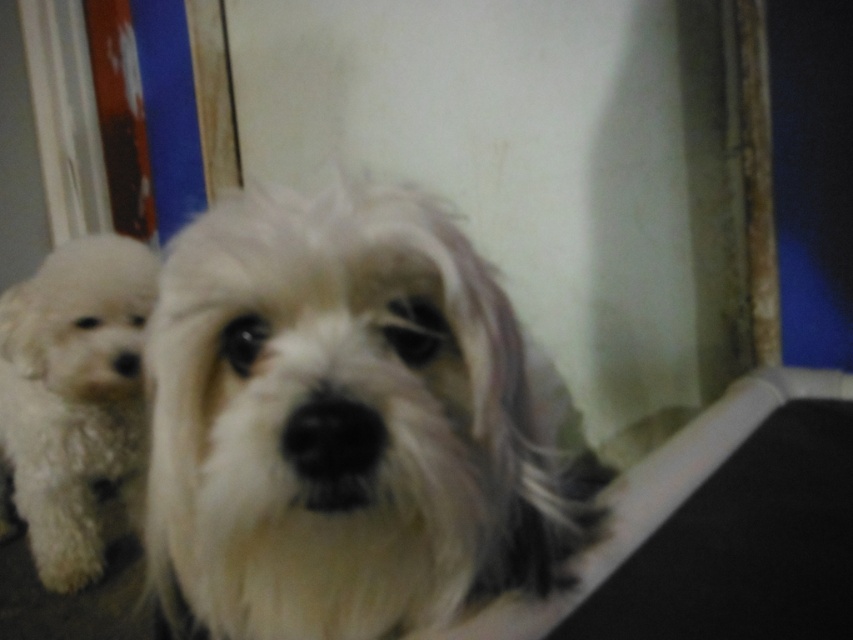
Is white fluffy dog at center smaller than white fluffy dog at left?

Indeed, white fluffy dog at center has a smaller size compared to white fluffy dog at left.

Does point (410, 413) lie in front of point (120, 236)?

Yes, point (410, 413) is in front of point (120, 236).

Image resolution: width=853 pixels, height=640 pixels. What are the coordinates of `white fluffy dog at center` in the screenshot? It's located at (349, 424).